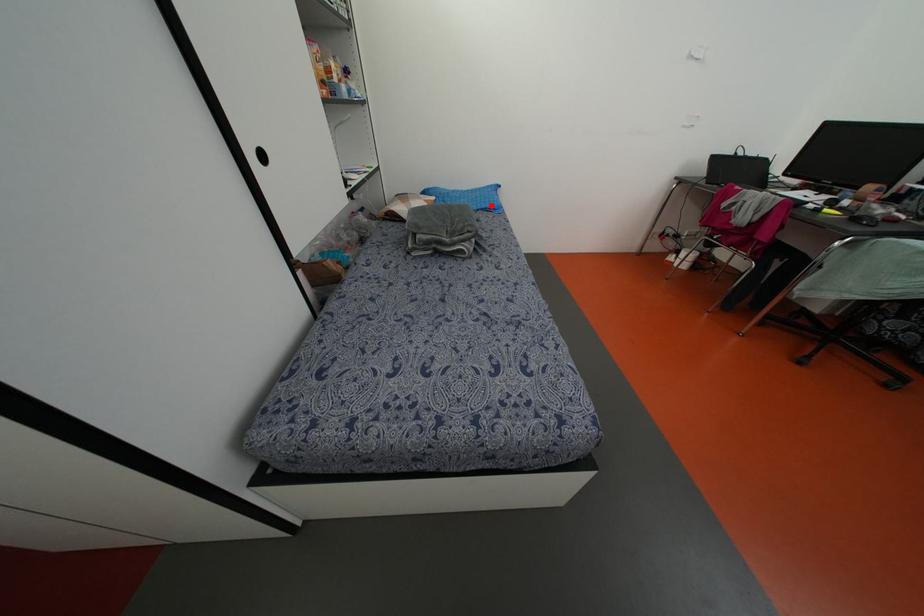
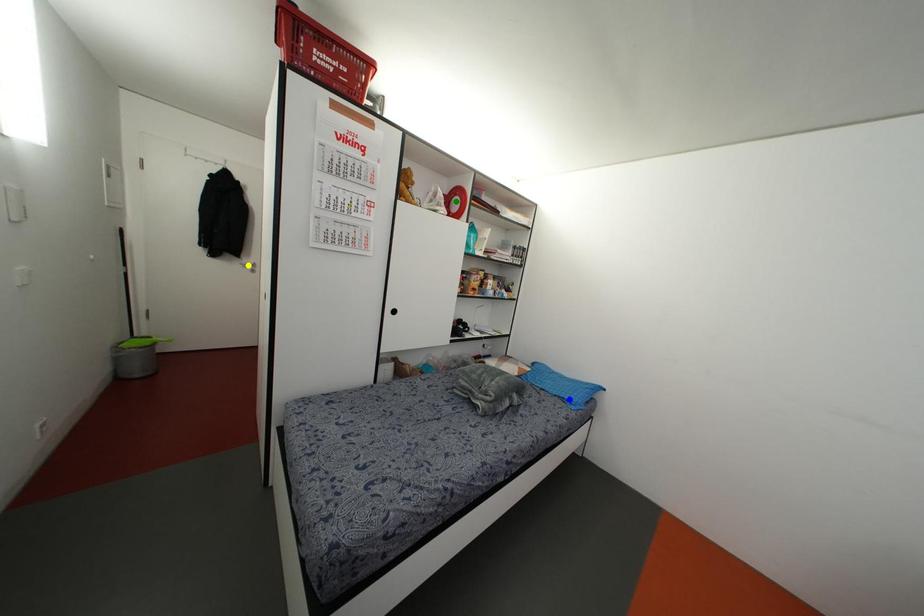
Question: I am providing you with two images of the same scene from different viewpoints. A red point is marked on the first image. You are given multiple points on the second image. Which point in image 2 is actually the same real-world point as the red point in image 1?

Choices:
 (A) yellow point
 (B) blue point
 (C) green point

Answer: (B)